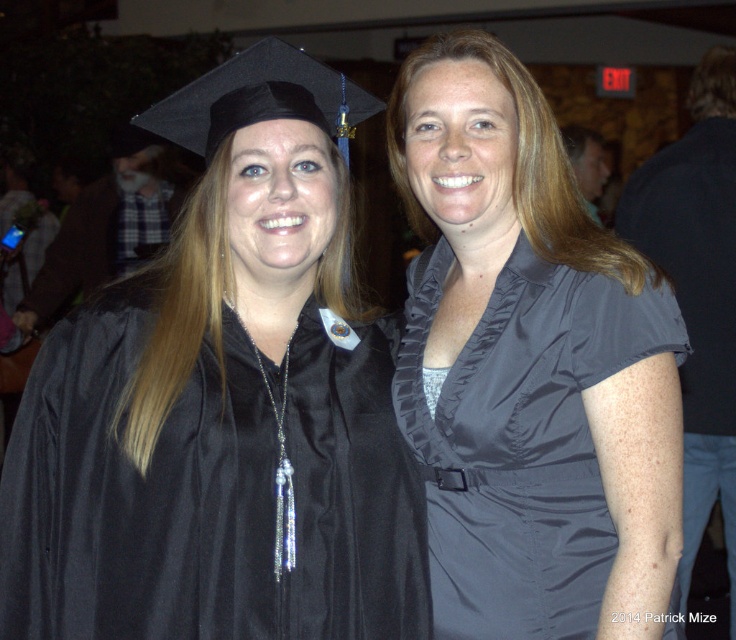
What do you see at coordinates (528, 368) in the screenshot? I see `satin gray blouse at center` at bounding box center [528, 368].

Is point (631, 544) positioned after point (682, 413)?

No, (631, 544) is in front of (682, 413).

Between point (408, 129) and point (622, 234), which one is positioned behind?

Point (622, 234)

This screenshot has width=736, height=640. What are the coordinates of `satin gray blouse at center` in the screenshot? It's located at (528, 368).

Between matte black graduation gown at center and black satin robe at right, which one is positioned lower?

black satin robe at right is below.

At what (x,y) coordinates should I click in order to perform the action: click on matte black graduation gown at center. Please return your answer as a coordinate pair (x, y). This screenshot has width=736, height=640. Looking at the image, I should click on (222, 404).

Between matte black graduation gown at center and satin gray blouse at center, which one appears on the left side from the viewer's perspective?

matte black graduation gown at center

Who is higher up, matte black graduation gown at center or satin gray blouse at center?

Positioned higher is satin gray blouse at center.

The width and height of the screenshot is (736, 640). I want to click on matte black graduation gown at center, so click(x=222, y=404).